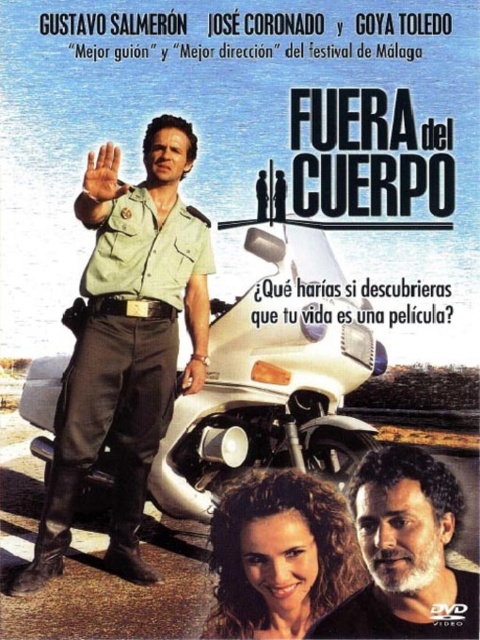
Is white glossy motorcycle at center shorter than bearded man at lower right?

No.

Who is positioned more to the left, white glossy motorcycle at center or bearded man at lower right?

white glossy motorcycle at center

Is point (345, 365) positioned after point (362, 632)?

Yes, point (345, 365) is behind point (362, 632).

The width and height of the screenshot is (480, 640). What are the coordinates of `white glossy motorcycle at center` in the screenshot? It's located at (273, 378).

Which of these two, green uniform at center or bearded man at lower right, stands shorter?

bearded man at lower right

Between point (111, 448) and point (428, 556), which one is positioned in front?

Positioned in front is point (428, 556).

Find the location of `green uniform at center`. green uniform at center is located at coordinates (127, 342).

Consider the image. Can you confirm if green uniform at center is positioned to the right of white glossy motorcycle at center?

Incorrect, green uniform at center is not on the right side of white glossy motorcycle at center.

Is green uniform at center bigger than white glossy motorcycle at center?

Indeed, green uniform at center has a larger size compared to white glossy motorcycle at center.

Is point (152, 451) closer to camera compared to point (275, 314)?

No, it is not.

Find the location of `green uniform at center`. green uniform at center is located at coordinates (127, 342).